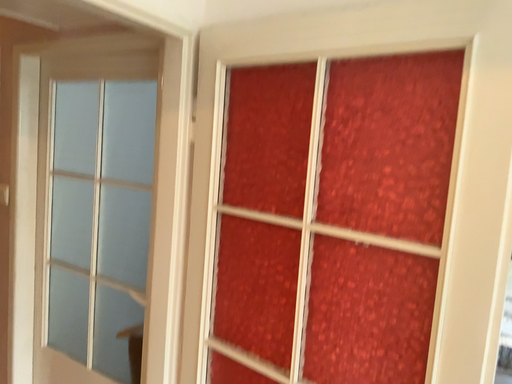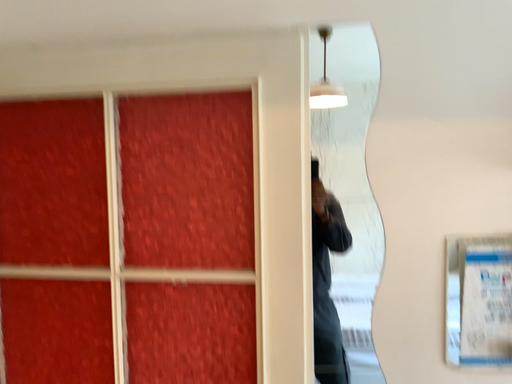
Question: Which way did the camera rotate in the video?

Choices:
 (A) rotated right
 (B) rotated left

Answer: (A)